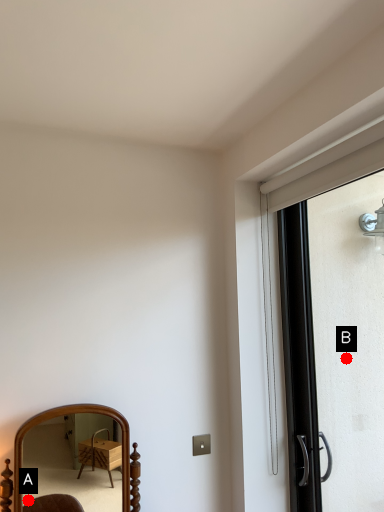
Question: Two points are circled on the image, labeled by A and B beside each circle. Which point is farther from the camera taking this photo?

Choices:
 (A) A is further
 (B) B is further

Answer: (A)